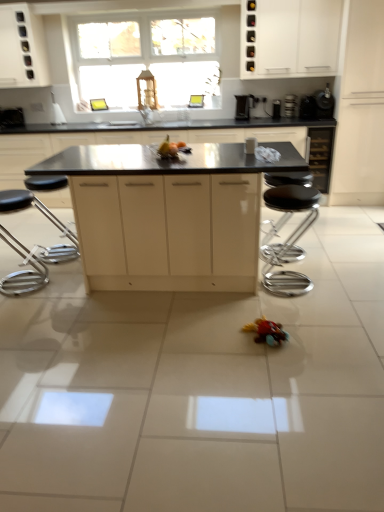
Where is `vacant point above polished chrome bar stool at right, which appears as the second bar stool when viewed from the left (from a real-world perspective)`? This screenshot has height=512, width=384. vacant point above polished chrome bar stool at right, which appears as the second bar stool when viewed from the left (from a real-world perspective) is located at coordinates (291, 187).